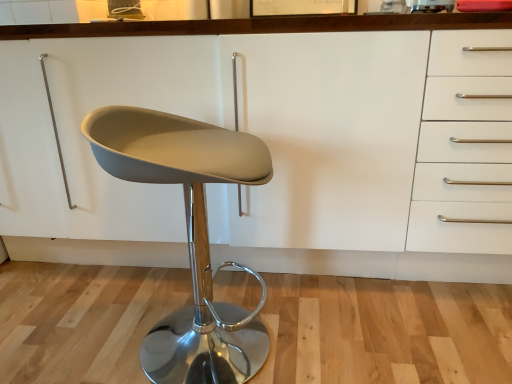
Question: Relative to white matte cabinet at center, is matte gray seat at center in front or behind?

Choices:
 (A) behind
 (B) front

Answer: (B)

Question: Does point (207, 261) appear closer or farther from the camera than point (460, 228)?

Choices:
 (A) closer
 (B) farther

Answer: (B)

Question: Is matte gray seat at center bigger or smaller than white matte cabinet at center?

Choices:
 (A) small
 (B) big

Answer: (A)

Question: Based on their positions, is white matte cabinet at center located to the left or right of matte gray seat at center?

Choices:
 (A) left
 (B) right

Answer: (B)

Question: Does point (168, 71) appear closer or farther from the camera than point (267, 170)?

Choices:
 (A) closer
 (B) farther

Answer: (B)

Question: From their relative heights in the image, would you say white matte cabinet at center is taller or shorter than matte gray seat at center?

Choices:
 (A) tall
 (B) short

Answer: (A)

Question: Considering the positions of white matte cabinet at center and matte gray seat at center in the image, is white matte cabinet at center wider or thinner than matte gray seat at center?

Choices:
 (A) thin
 (B) wide

Answer: (B)